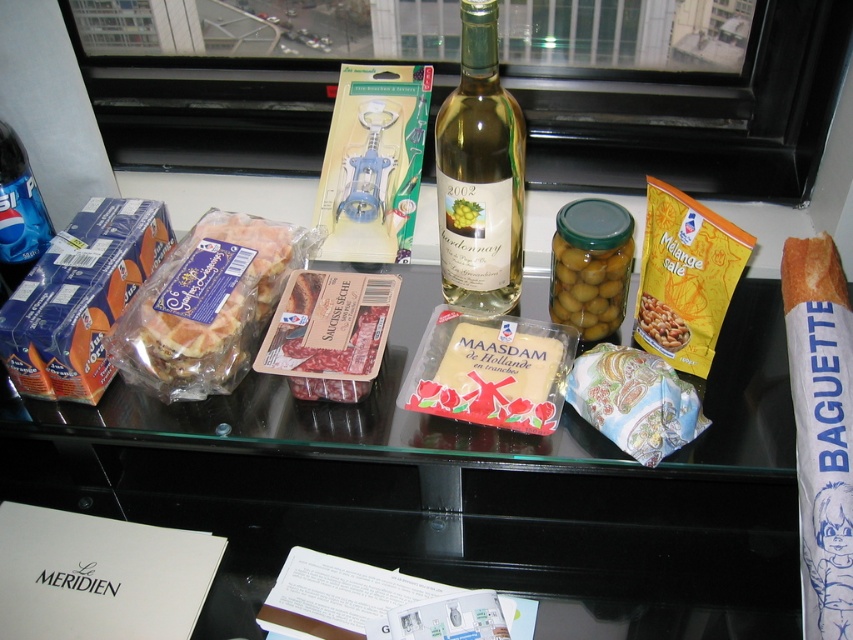
Question: Among these objects, which one is farthest from the camera?

Choices:
 (A) smooth creamy nuts at center
 (B) green glass bottle at center

Answer: (A)

Question: Considering the relative positions of white paper cheese at center and green glass jar at center in the image provided, where is white paper cheese at center located with respect to green glass jar at center?

Choices:
 (A) below
 (B) above

Answer: (A)

Question: Can you confirm if matte plastic baguette at center is smaller than smooth creamy nuts at center?

Choices:
 (A) yes
 (B) no

Answer: (B)

Question: Based on their relative distances, which object is farther from the dark red glossy meat at center?

Choices:
 (A) matte plastic baguette at center
 (B) yellow paper bag of melange salé at center right
 (C) green glass bottle at center

Answer: (B)

Question: Estimate the real-world distances between objects in this image. Which object is closer to the green glass jar at center?

Choices:
 (A) blue plastic bottle at left
 (B) dark red glossy meat at center

Answer: (B)

Question: Where is green glass bottle at center located in relation to yellow paper bag of melange salé at center right in the image?

Choices:
 (A) above
 (B) below

Answer: (A)